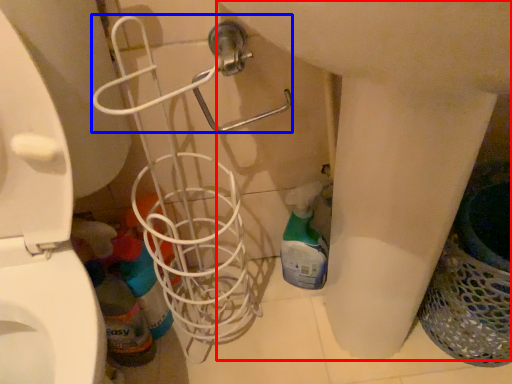
Question: Which object appears closest to the camera in this image, sink (highlighted by a red box) or shower (highlighted by a blue box)?

Choices:
 (A) sink
 (B) shower

Answer: (A)